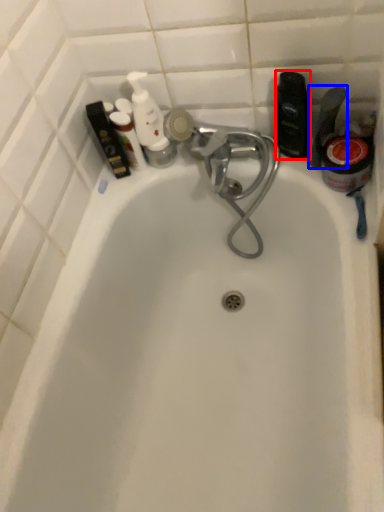
Question: Among these objects, which one is nearest to the camera, toiletry (highlighted by a red box) or toiletry (highlighted by a blue box)?

Choices:
 (A) toiletry
 (B) toiletry

Answer: (B)